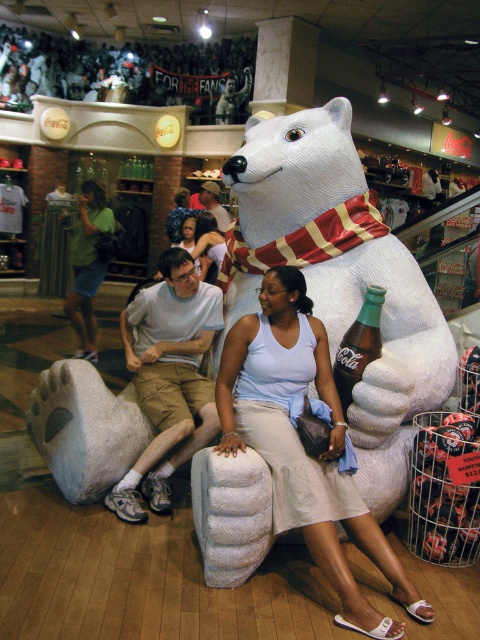
Question: Considering the real-world distances, which object is closest to the light blue tank top at center?

Choices:
 (A) green fabric shirt at left
 (B) white matte polar bear at center

Answer: (A)

Question: Does light blue fabric dress at center appear on the left side of light blue tank top at center?

Choices:
 (A) yes
 (B) no

Answer: (B)

Question: Which point is farther to the camera?

Choices:
 (A) light blue tank top at center
 (B) khaki shorts at center

Answer: (A)

Question: Does green fabric shirt at left appear on the right side of light brown fabric shirt at center?

Choices:
 (A) no
 (B) yes

Answer: (A)

Question: Does light blue fabric dress at center have a larger size compared to green fabric shirt at left?

Choices:
 (A) yes
 (B) no

Answer: (A)

Question: Which point is farther from the camera taking this photo?

Choices:
 (A) (72, 253)
 (B) (135, 326)
 (C) (219, 221)

Answer: (A)